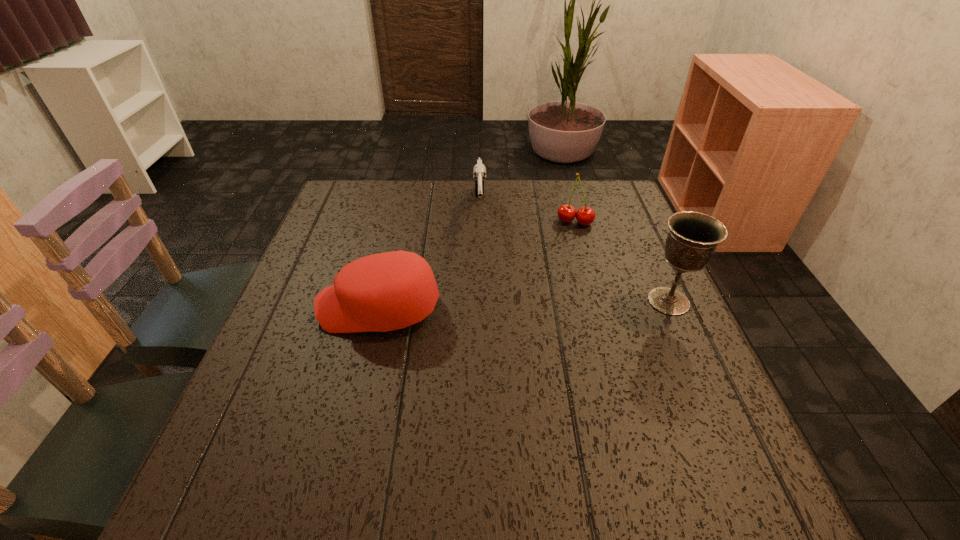
Locate an element on the screen. This screenshot has height=540, width=960. vacant space at the right edge of the desktop is located at coordinates (600, 234).

Locate an element on the screen. vacant region at the far left corner of the desktop is located at coordinates (362, 184).

Identify the location of free spot at the near left corner of the desktop. The width and height of the screenshot is (960, 540). (300, 437).

Where is `vacant space at the far right corner`? The image size is (960, 540). vacant space at the far right corner is located at coordinates (636, 217).

At what (x,y) coordinates should I click in order to perform the action: click on free point between the second object from right to left and the chalice. Please return your answer as a coordinate pair (x, y). Looking at the image, I should click on (622, 261).

At what (x,y) coordinates should I click in order to perform the action: click on vacant area that lies between the gun and the tallest object. Please return your answer as a coordinate pair (x, y). The width and height of the screenshot is (960, 540). Looking at the image, I should click on (574, 255).

Where is `vacant area that lies between the cherry and the chalice`? This screenshot has width=960, height=540. vacant area that lies between the cherry and the chalice is located at coordinates (622, 261).

You are a GUI agent. You are given a task and a screenshot of the screen. Output one action in this format:
    pyautogui.click(x=<x>, y=<y>)
    Task: Click on the vacant area that lies between the tallest object and the third object from left to right
    
    Given the screenshot: What is the action you would take?
    pyautogui.click(x=622, y=261)

Find the location of `empty location between the cap and the gun`. empty location between the cap and the gun is located at coordinates (429, 259).

This screenshot has height=540, width=960. What are the coordinates of `free point between the cap and the tallest object` in the screenshot? It's located at (524, 305).